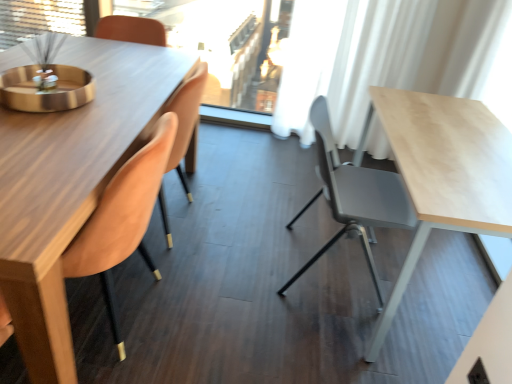
Question: Is point (349, 208) closer or farther from the camera than point (97, 251)?

Choices:
 (A) closer
 (B) farther

Answer: (B)

Question: Which is correct: matte gray chair at center, which is the 1th chair from right to left, is inside velvet orange chair at left, which appears as the 1th chair when viewed from the left, or outside of it?

Choices:
 (A) inside
 (B) outside

Answer: (B)

Question: Estimate the real-world distances between objects in this image. Which object is farther from the white sheer curtain at upper center?

Choices:
 (A) matte gray chair at center, the 2th chair positioned from the left
 (B) velvet orange chair at left, which appears as the 1th chair when viewed from the left
 (C) white sheer curtain at upper right

Answer: (B)

Question: Which is farther from the white sheer curtain at upper center?

Choices:
 (A) velvet orange chair at left, which appears as the 1th chair when viewed from the left
 (B) matte gray chair at center, which is the 1th chair from right to left
 (C) white sheer curtain at upper right

Answer: (A)